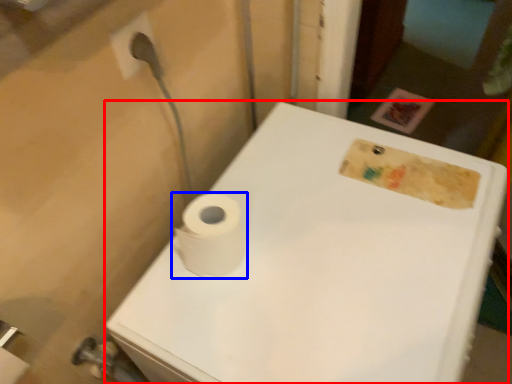
Question: Among these objects, which one is farthest to the camera, porcelain (highlighted by a red box) or toilet paper (highlighted by a blue box)?

Choices:
 (A) porcelain
 (B) toilet paper

Answer: (B)